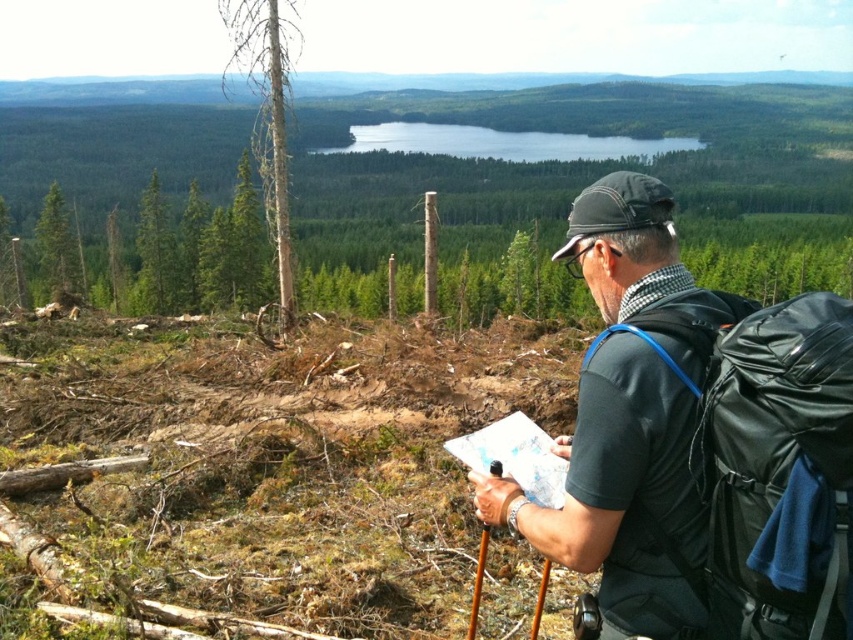
Question: Among these objects, which one is farthest from the camera?

Choices:
 (A) blue glassy lake at center
 (B) black synthetic backpack at right
 (C) smooth bark tree at center
 (D) green rough bark tree at left

Answer: (A)

Question: Based on their relative distances, which object is nearer to the smooth bark tree at center?

Choices:
 (A) blue glassy lake at center
 (B) green rough bark tree at left
 (C) black fabric backpack at right
 (D) green matte tree at upper left

Answer: (D)

Question: Does black synthetic backpack at right appear over green rough bark tree at left?

Choices:
 (A) yes
 (B) no

Answer: (B)

Question: Is black synthetic backpack at right above blue glassy lake at center?

Choices:
 (A) yes
 (B) no

Answer: (B)

Question: Estimate the real-world distances between objects in this image. Which object is farther from the green rough bark tree at left?

Choices:
 (A) white smooth tree at upper left
 (B) black synthetic backpack at right
 (C) blue glassy lake at center

Answer: (C)

Question: Is black fabric backpack at right above green rough bark tree at left?

Choices:
 (A) no
 (B) yes

Answer: (A)